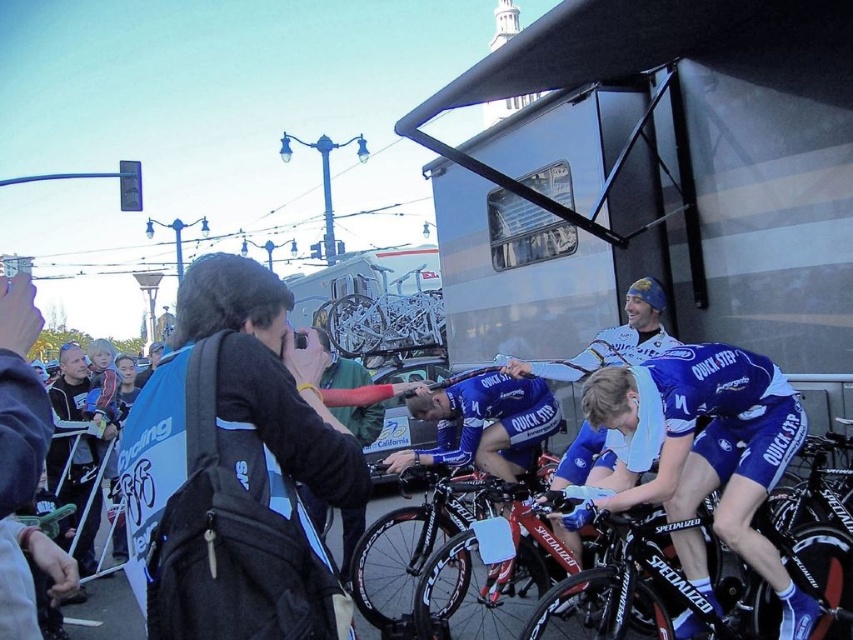
Question: Which object is positioned closest to the black matte bicycle at center?

Choices:
 (A) silver metallic trailer at upper right
 (B) black fabric backpack at center
 (C) blue matte bicycle helmet at center

Answer: (B)

Question: Which point is closer to the camera?

Choices:
 (A) black matte bicycle at center
 (B) blue matte bicycle helmet at center

Answer: (A)

Question: Among these objects, which one is nearest to the camera?

Choices:
 (A) blue matte bicycle helmet at center
 (B) blue jersey at center
 (C) black fabric backpack at center

Answer: (C)

Question: Considering the relative positions of black matte bicycle at center and silver metallic bicycle at center in the image provided, where is black matte bicycle at center located with respect to silver metallic bicycle at center?

Choices:
 (A) right
 (B) left

Answer: (A)

Question: Does blue jersey at center appear over black fabric backpack at center?

Choices:
 (A) no
 (B) yes

Answer: (A)

Question: Does silver metallic trailer at upper right lie behind silver metallic bicycle at center?

Choices:
 (A) no
 (B) yes

Answer: (A)